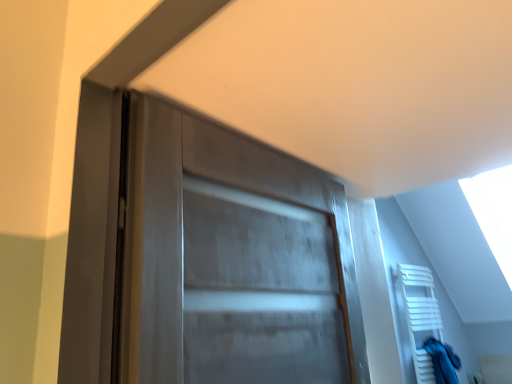
Question: Is white wooden towel rack at lower right bigger or smaller than blue fabric at right?

Choices:
 (A) big
 (B) small

Answer: (A)

Question: Relative to blue fabric at right, is white wooden towel rack at lower right in front or behind?

Choices:
 (A) behind
 (B) front

Answer: (B)

Question: From the image's perspective, is white wooden towel rack at lower right above or below blue fabric at right?

Choices:
 (A) above
 (B) below

Answer: (A)

Question: Visually, is blue fabric at right positioned to the left or to the right of white wooden towel rack at lower right?

Choices:
 (A) right
 (B) left

Answer: (A)

Question: From a real-world perspective, relative to white wooden towel rack at lower right, is blue fabric at right vertically above or below?

Choices:
 (A) below
 (B) above

Answer: (A)

Question: Is point (448, 362) positioned closer to the camera than point (412, 281)?

Choices:
 (A) farther
 (B) closer

Answer: (B)

Question: Looking at the image, does blue fabric at right seem bigger or smaller compared to white wooden towel rack at lower right?

Choices:
 (A) small
 (B) big

Answer: (A)